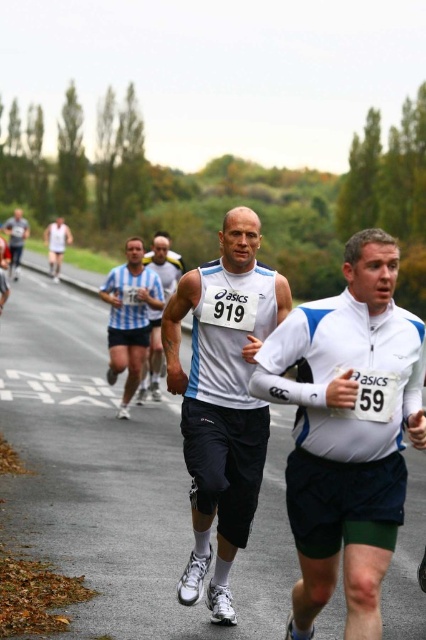
Question: Which point appears closest to the camera in this image?

Choices:
 (A) (5, 227)
 (B) (149, 348)

Answer: (B)

Question: Can you confirm if white matte running shirt at center is positioned below white mesh tank top at left?

Choices:
 (A) no
 (B) yes

Answer: (B)

Question: Which point appears closest to the camera in this image?

Choices:
 (A) (331, 353)
 (B) (66, 244)

Answer: (A)

Question: Does white matte running shirt at center have a larger size compared to white matte running shorts at center?

Choices:
 (A) yes
 (B) no

Answer: (B)

Question: Does white matte running shirt at center appear over blue striped shirt at center?

Choices:
 (A) no
 (B) yes

Answer: (A)

Question: Which point appears farthest from the camera in this image?

Choices:
 (A) (146, 317)
 (B) (14, 221)
 (C) (57, 269)
 (D) (137, 396)

Answer: (B)